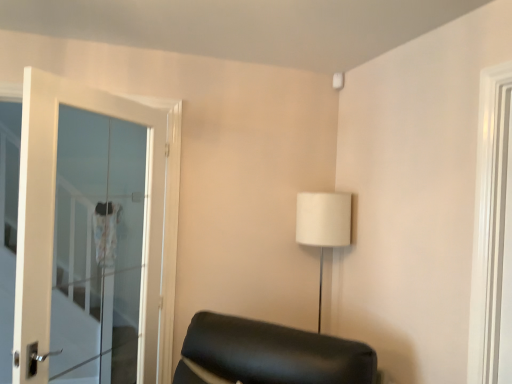
Question: From a real-world perspective, does white glossy door at right stand above white glass door at left?

Choices:
 (A) yes
 (B) no

Answer: (A)

Question: Does white glossy door at right have a lesser width compared to white glass door at left?

Choices:
 (A) yes
 (B) no

Answer: (A)

Question: Is white glossy door at right bigger than white glass door at left?

Choices:
 (A) yes
 (B) no

Answer: (B)

Question: Would you say white glossy door at right is outside white glass door at left?

Choices:
 (A) yes
 (B) no

Answer: (A)

Question: Considering the relative sizes of white glossy door at right and white glass door at left in the image provided, is white glossy door at right smaller than white glass door at left?

Choices:
 (A) no
 (B) yes

Answer: (B)

Question: Considering the relative sizes of white glossy door at right and white glass door at left in the image provided, is white glossy door at right shorter than white glass door at left?

Choices:
 (A) no
 (B) yes

Answer: (B)

Question: Does white glass door at left lie behind white fabric lampshade at upper right?

Choices:
 (A) no
 (B) yes

Answer: (A)

Question: From a real-world perspective, is white glass door at left under white fabric lampshade at upper right?

Choices:
 (A) no
 (B) yes

Answer: (A)

Question: Can white fabric lampshade at upper right be found inside white glass door at left?

Choices:
 (A) yes
 (B) no

Answer: (B)

Question: From the image's perspective, is white glass door at left on top of white fabric lampshade at upper right?

Choices:
 (A) no
 (B) yes

Answer: (B)

Question: From a real-world perspective, is white glass door at left on top of white fabric lampshade at upper right?

Choices:
 (A) no
 (B) yes

Answer: (B)

Question: Is white glass door at left positioned beyond the bounds of white fabric lampshade at upper right?

Choices:
 (A) no
 (B) yes

Answer: (B)

Question: Is white fabric lampshade at upper right to the right of white glossy door at right from the viewer's perspective?

Choices:
 (A) yes
 (B) no

Answer: (B)